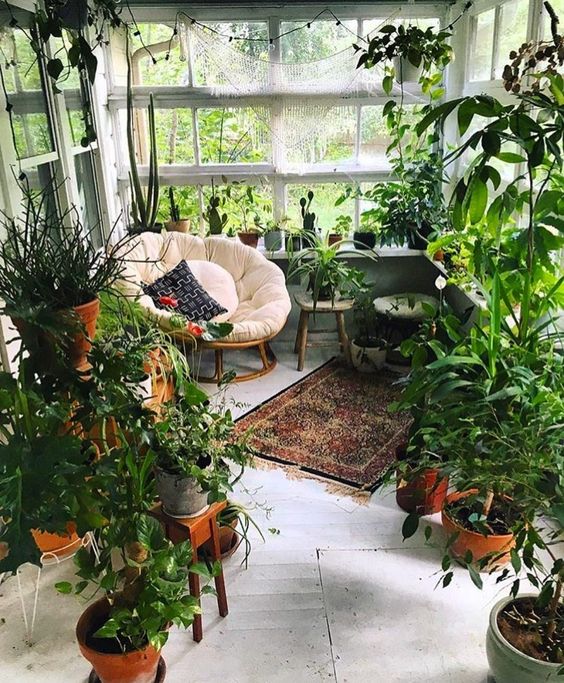
Find the location of a particular element. window is located at coordinates (209, 128), (374, 128), (488, 55), (30, 128).